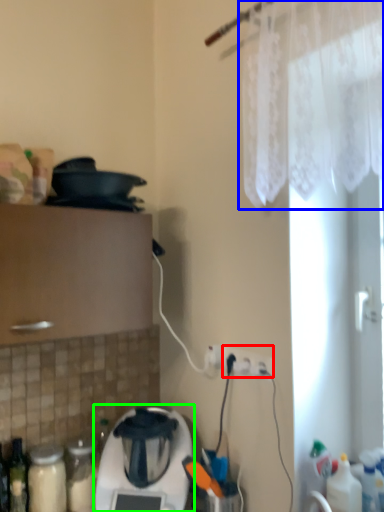
Question: Which object is the closest to the electric outlet (highlighted by a red box)? Choose among these: curtain (highlighted by a blue box) or home appliance (highlighted by a green box).

Choices:
 (A) curtain
 (B) home appliance

Answer: (B)